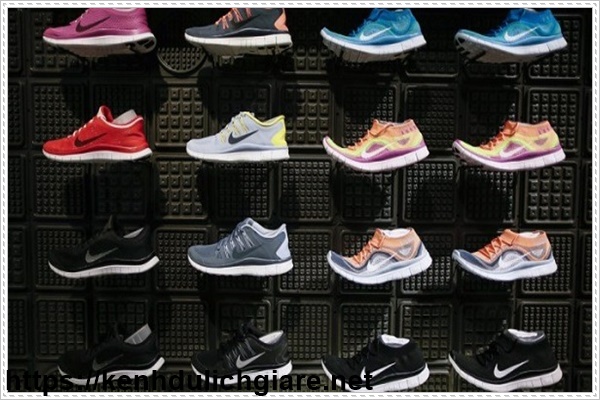
Where is `shoes on the second lowest row`? shoes on the second lowest row is located at coordinates (487, 262), (372, 267), (219, 260), (122, 255).